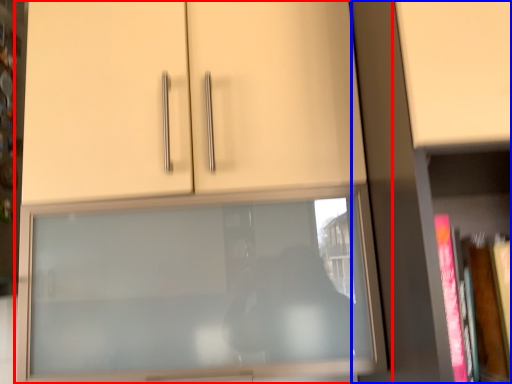
Question: Among these objects, which one is farthest to the camera, cupboard (highlighted by a red box) or bookcase (highlighted by a blue box)?

Choices:
 (A) cupboard
 (B) bookcase

Answer: (A)